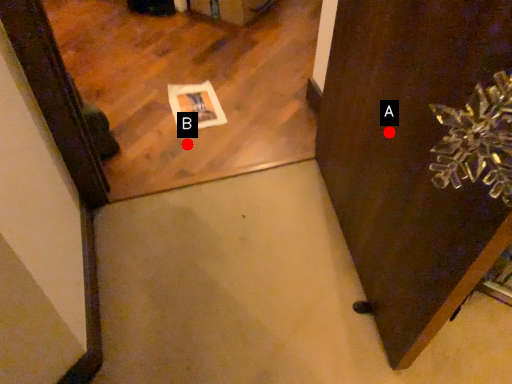
Question: Two points are circled on the image, labeled by A and B beside each circle. Among these points, which one is nearest to the camera?

Choices:
 (A) A is closer
 (B) B is closer

Answer: (A)